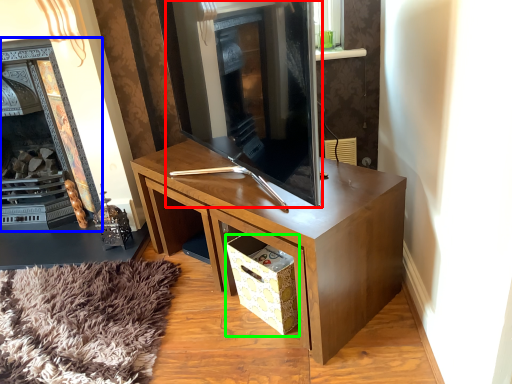
Question: Based on their relative distances, which object is nearer to fireplace (highlighted by a red box)? Choose from fireplace (highlighted by a blue box) and drawer (highlighted by a green box).

Choices:
 (A) fireplace
 (B) drawer

Answer: (B)